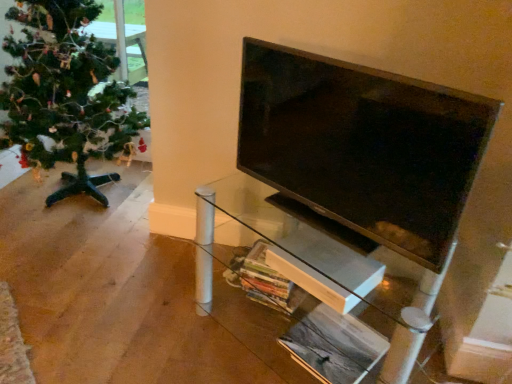
Locate an element on the screen. The height and width of the screenshot is (384, 512). free space in front of green matte christmas tree at left is located at coordinates (71, 280).